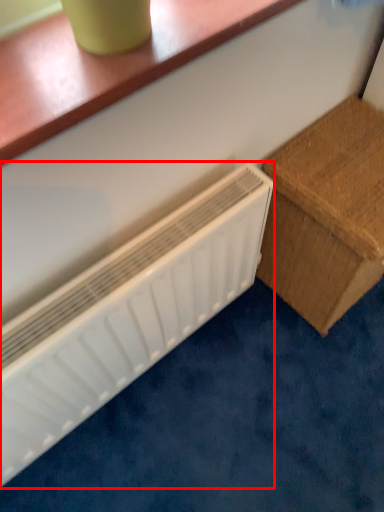
Question: Where is radiator (annotated by the red box) located in relation to furniture in the image?

Choices:
 (A) right
 (B) left

Answer: (B)